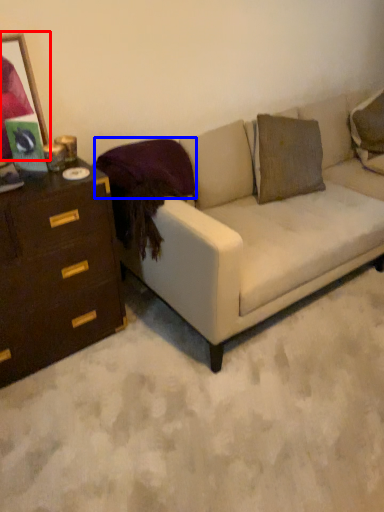
Question: Among these objects, which one is nearest to the camera, picture frame (highlighted by a red box) or pillow (highlighted by a blue box)?

Choices:
 (A) picture frame
 (B) pillow

Answer: (A)